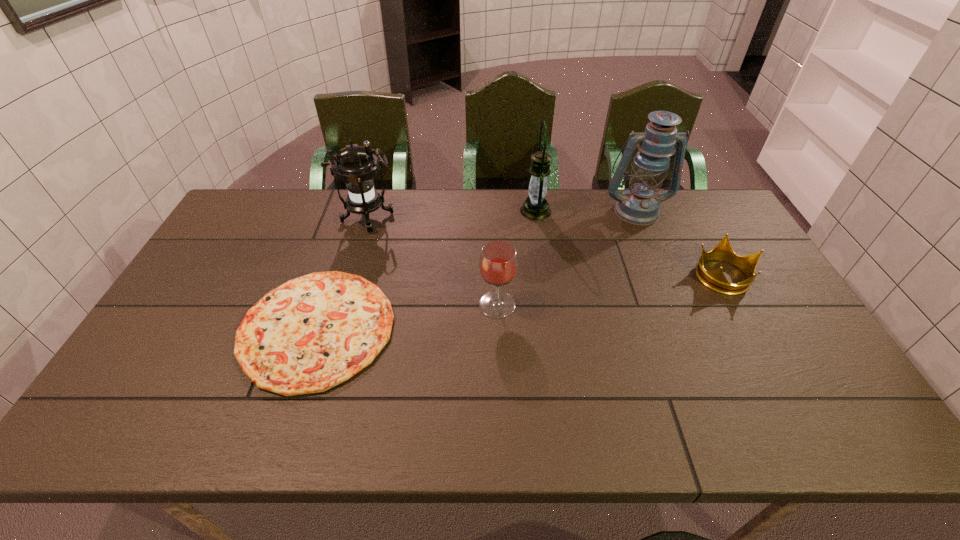
The height and width of the screenshot is (540, 960). Identify the location of vacant region located on the side where the fourth object from left to right emits light. (466, 211).

You are a GUI agent. You are given a task and a screenshot of the screen. Output one action in this format:
    pyautogui.click(x=<x>, y=<y>)
    Task: Click on the vacant space located on the left of the leftmost lantern
    
    Given the screenshot: What is the action you would take?
    [x=266, y=219]

Image resolution: width=960 pixels, height=540 pixels. Find the location of `vacant space located on the back of the wineglass`. vacant space located on the back of the wineglass is located at coordinates (495, 265).

Identify the location of vacant space located on the front of the fifth tallest object. (767, 355).

Where is `vacant area located on the back of the pizza`? vacant area located on the back of the pizza is located at coordinates (349, 230).

Image resolution: width=960 pixels, height=540 pixels. What are the coordinates of `object that is positioned at the right edge` in the screenshot? It's located at (715, 280).

You are a GUI agent. You are given a task and a screenshot of the screen. Output one action in this format:
    pyautogui.click(x=<x>, y=<y>)
    Task: Click on the vacant area at the far edge of the desktop
    This screenshot has width=960, height=540.
    Given the screenshot: What is the action you would take?
    (x=323, y=214)

Image resolution: width=960 pixels, height=540 pixels. In the image, there is a desktop. What are the coordinates of `free space at the left edge` in the screenshot? It's located at (206, 268).

What are the coordinates of `free space at the right edge` in the screenshot? It's located at (764, 298).

You are a GUI agent. You are given a task and a screenshot of the screen. Output one action in this format:
    pyautogui.click(x=<x>, y=<y>)
    Task: Click on the free space at the far left corner of the desktop
    Image resolution: width=960 pixels, height=540 pixels.
    Given the screenshot: What is the action you would take?
    pyautogui.click(x=256, y=191)